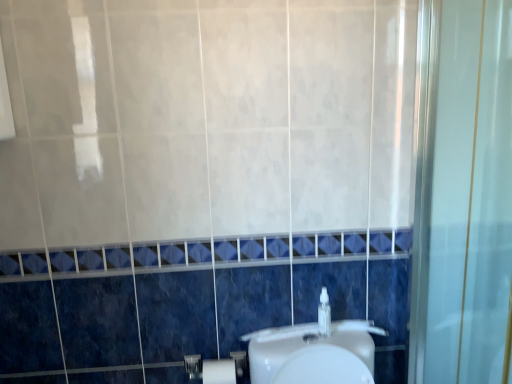
This screenshot has height=384, width=512. What do you see at coordinates (324, 313) in the screenshot?
I see `clear plastic bottle at center` at bounding box center [324, 313].

At what (x,y) coordinates should I click in order to perform the action: click on clear plastic bottle at center. Please return your answer as a coordinate pair (x, y). The image size is (512, 384). Looking at the image, I should click on (324, 313).

Where is `white matte toilet paper at lower center`? white matte toilet paper at lower center is located at coordinates (219, 371).

The height and width of the screenshot is (384, 512). Describe the element at coordinates (219, 371) in the screenshot. I see `white matte toilet paper at lower center` at that location.

What is the approximate width of white matte toilet paper at lower center?

4.63 inches.

What are the coordinates of `clear plastic bottle at center` in the screenshot? It's located at (324, 313).

Which object is positioned more to the left, clear plastic bottle at center or white matte toilet paper at lower center?

white matte toilet paper at lower center.

Is clear plastic bottle at center in front of or behind white matte toilet paper at lower center in the image?

In the image, clear plastic bottle at center appears in front of white matte toilet paper at lower center.

Between point (329, 315) and point (234, 368), which one is positioned in front?

The point (234, 368) is closer to the camera.

From the image's perspective, is clear plastic bottle at center on top of white matte toilet paper at lower center?

Yes, from the image's perspective, clear plastic bottle at center is on top of white matte toilet paper at lower center.

From a real-world perspective, is clear plastic bottle at center below white matte toilet paper at lower center?

Incorrect, from a real-world perspective, clear plastic bottle at center is higher than white matte toilet paper at lower center.

Which of these two, clear plastic bottle at center or white matte toilet paper at lower center, is thinner?

clear plastic bottle at center.

Does clear plastic bottle at center have a lesser height compared to white matte toilet paper at lower center?

Correct, clear plastic bottle at center is not as tall as white matte toilet paper at lower center.

Between clear plastic bottle at center and white matte toilet paper at lower center, which one has smaller size?

Smaller between the two is clear plastic bottle at center.

Is clear plastic bottle at center located outside white matte toilet paper at lower center?

Yes.

Is clear plastic bottle at center positioned far away from white matte toilet paper at lower center?

clear plastic bottle at center is actually quite close to white matte toilet paper at lower center.

Is clear plastic bottle at center aimed at white matte toilet paper at lower center?

No, clear plastic bottle at center is not oriented towards white matte toilet paper at lower center.

Can you tell me how much clear plastic bottle at center and white matte toilet paper at lower center differ in facing direction?

clear plastic bottle at center and white matte toilet paper at lower center are facing 0.000205 degrees away from each other.

Locate an element on the screen. soap dispenser above the white matte toilet paper at lower center (from the image's perspective) is located at coordinates (324, 313).

Is white matte toilet paper at lower center at the right side of clear plastic bottle at center?

No, white matte toilet paper at lower center is not to the right of clear plastic bottle at center.

Between white matte toilet paper at lower center and clear plastic bottle at center, which one is positioned behind?

white matte toilet paper at lower center is more distant.

Is point (224, 359) farther from camera compared to point (325, 315)?

Yes, it is.

From the image's perspective, which is above, white matte toilet paper at lower center or clear plastic bottle at center?

clear plastic bottle at center.

From a real-world perspective, between white matte toilet paper at lower center and clear plastic bottle at center, who is vertically lower?

From a 3D spatial view, white matte toilet paper at lower center is below.

Based on the photo, can you confirm if white matte toilet paper at lower center is thinner than clear plastic bottle at center?

No, white matte toilet paper at lower center is not thinner than clear plastic bottle at center.

From the picture: Who is taller, white matte toilet paper at lower center or clear plastic bottle at center?

Standing taller between the two is white matte toilet paper at lower center.

Who is smaller, white matte toilet paper at lower center or clear plastic bottle at center?

With smaller size is clear plastic bottle at center.

Is white matte toilet paper at lower center situated inside clear plastic bottle at center or outside?

The correct answer is: outside.

Are white matte toilet paper at lower center and clear plastic bottle at center far apart?

No.

Looking at this image, is white matte toilet paper at lower center oriented towards clear plastic bottle at center?

No, white matte toilet paper at lower center is not oriented towards clear plastic bottle at center.

This screenshot has width=512, height=384. I want to click on soap dispenser positioned vertically above the white matte toilet paper at lower center (from a real-world perspective), so click(x=324, y=313).

At what (x,y) coordinates should I click in order to perform the action: click on soap dispenser on the right side of white matte toilet paper at lower center. Please return your answer as a coordinate pair (x, y). Looking at the image, I should click on (324, 313).

This screenshot has height=384, width=512. What are the coordinates of `toilet paper to the left of clear plastic bottle at center` in the screenshot? It's located at (219, 371).